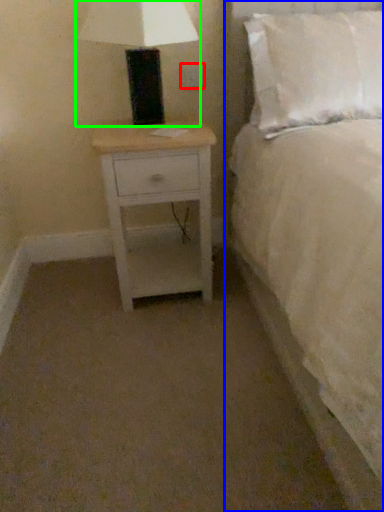
Question: Which object is positioned farthest from electric outlet (highlighted by a red box)? Select from bed (highlighted by a blue box) and table lamp (highlighted by a green box).

Choices:
 (A) bed
 (B) table lamp

Answer: (A)